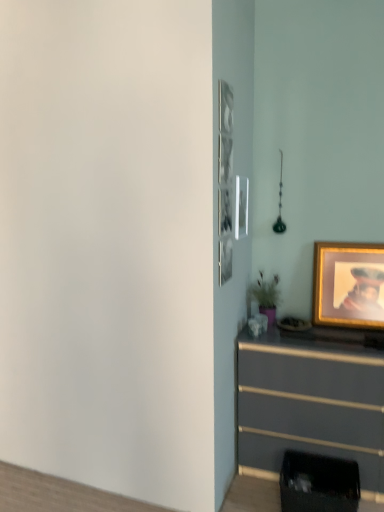
Locate an element on the screen. empty space that is ontop of matte gray chest of drawers at lower right (from a real-world perspective) is located at coordinates (304, 334).